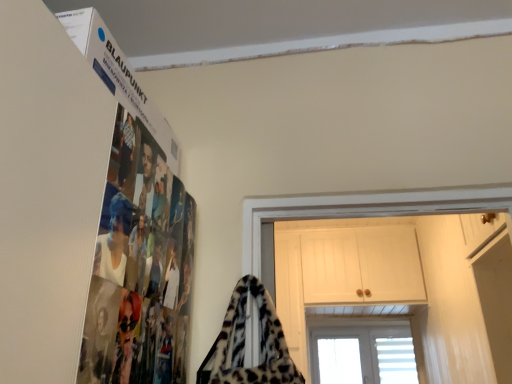
Question: Is white wood cabinet at upper center at the left side of leopard print fur at center?

Choices:
 (A) no
 (B) yes

Answer: (A)

Question: Does white wood cabinet at upper center have a greater width compared to leopard print fur at center?

Choices:
 (A) no
 (B) yes

Answer: (B)

Question: Can you confirm if white wood cabinet at upper center is bigger than leopard print fur at center?

Choices:
 (A) no
 (B) yes

Answer: (B)

Question: Can you confirm if white wood cabinet at upper center is thinner than leopard print fur at center?

Choices:
 (A) yes
 (B) no

Answer: (B)

Question: Does white wood cabinet at upper center appear on the right side of leopard print fur at center?

Choices:
 (A) no
 (B) yes

Answer: (B)

Question: Are white wood cabinet at upper center and leopard print fur at center making contact?

Choices:
 (A) yes
 (B) no

Answer: (B)

Question: Is leopard print fur at center next to white wood cabinet at upper center?

Choices:
 (A) no
 (B) yes

Answer: (A)

Question: Does leopard print fur at center have a larger size compared to white wood cabinet at upper center?

Choices:
 (A) yes
 (B) no

Answer: (B)

Question: Is leopard print fur at center positioned before white wood cabinet at upper center?

Choices:
 (A) yes
 (B) no

Answer: (A)

Question: Is leopard print fur at center further to the viewer compared to white wood cabinet at upper center?

Choices:
 (A) yes
 (B) no

Answer: (B)

Question: Is leopard print fur at center oriented away from white wood cabinet at upper center?

Choices:
 (A) no
 (B) yes

Answer: (B)

Question: Does leopard print fur at center turn towards white wood cabinet at upper center?

Choices:
 (A) no
 (B) yes

Answer: (A)

Question: Which is correct: white wood cabinet at upper center is inside leopard print fur at center, or outside of it?

Choices:
 (A) inside
 (B) outside

Answer: (B)